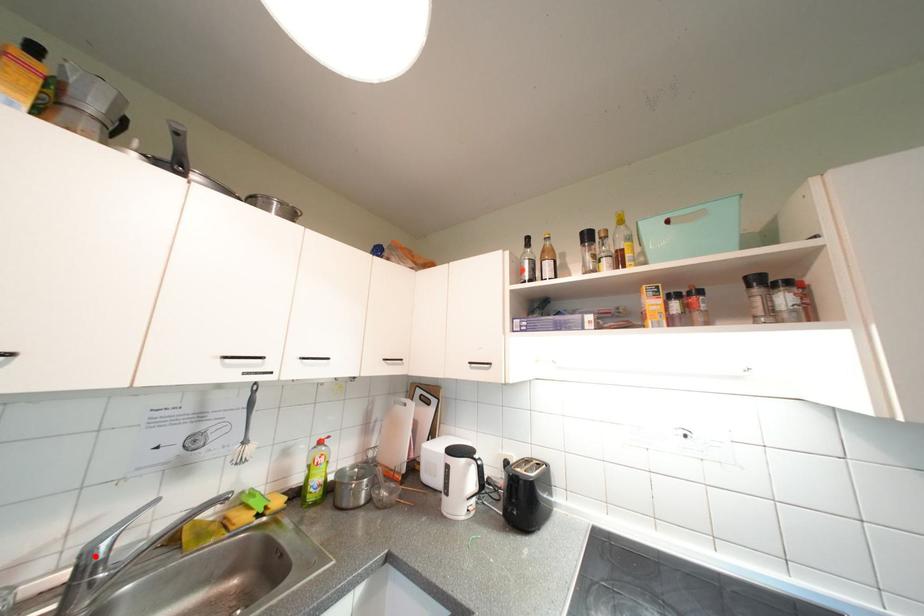
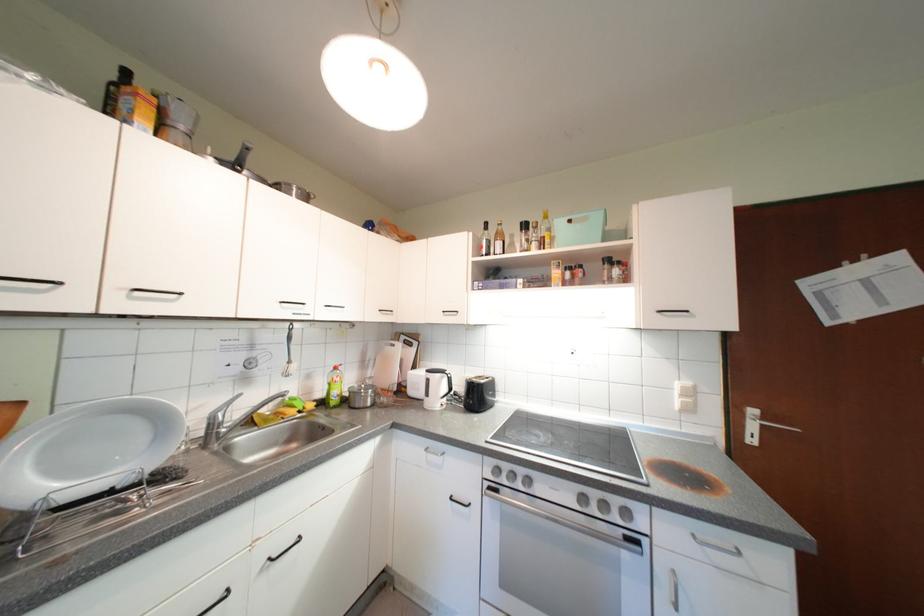
The point at the highlighted location is marked in the first image. Where is the corresponding point in the second image?

(220, 419)